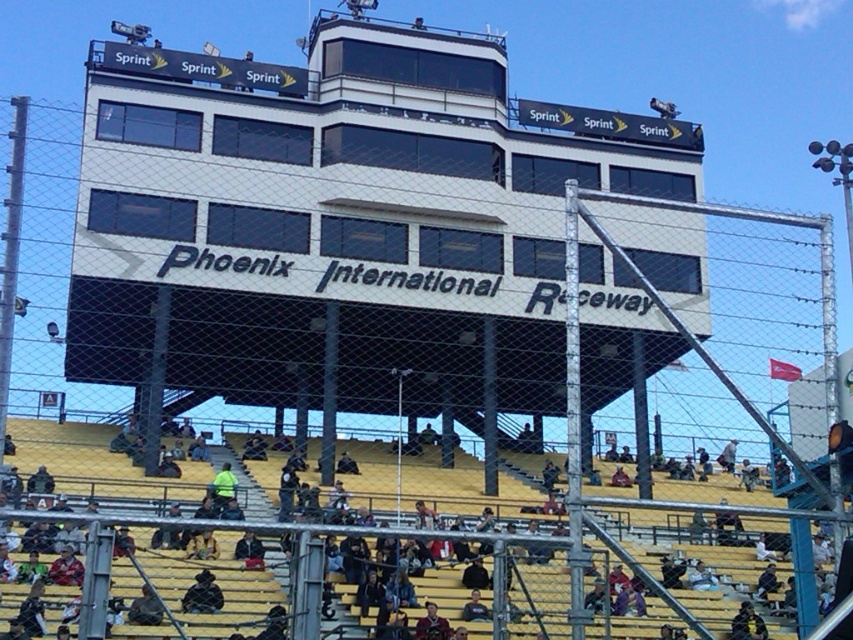
Is the position of yellow wood bleachers at lower center more distant than that of dark gray jacket at lower left?

No, it is in front of dark gray jacket at lower left.

Identify the location of yellow wood bleachers at lower center. (550, 595).

Where is `yellow wood bleachers at lower center`? The image size is (853, 640). yellow wood bleachers at lower center is located at coordinates (550, 595).

Between yellow wood bleachers at lower center and dark blue jacket at lower center, which one is positioned lower?

dark blue jacket at lower center is below.

What are the coordinates of `yellow wood bleachers at lower center` in the screenshot? It's located at (550, 595).

The image size is (853, 640). Identify the location of yellow wood bleachers at lower center. 550,595.

Does dark blue jacket at lower center have a lesser width compared to dark gray jacket at lower left?

In fact, dark blue jacket at lower center might be wider than dark gray jacket at lower left.

Based on the photo, is dark blue jacket at lower center positioned at the back of dark gray jacket at lower left?

That is True.

This screenshot has height=640, width=853. Describe the element at coordinates (202, 595) in the screenshot. I see `dark blue jacket at lower center` at that location.

Find the location of a particular element. The image size is (853, 640). dark blue jacket at lower center is located at coordinates (202, 595).